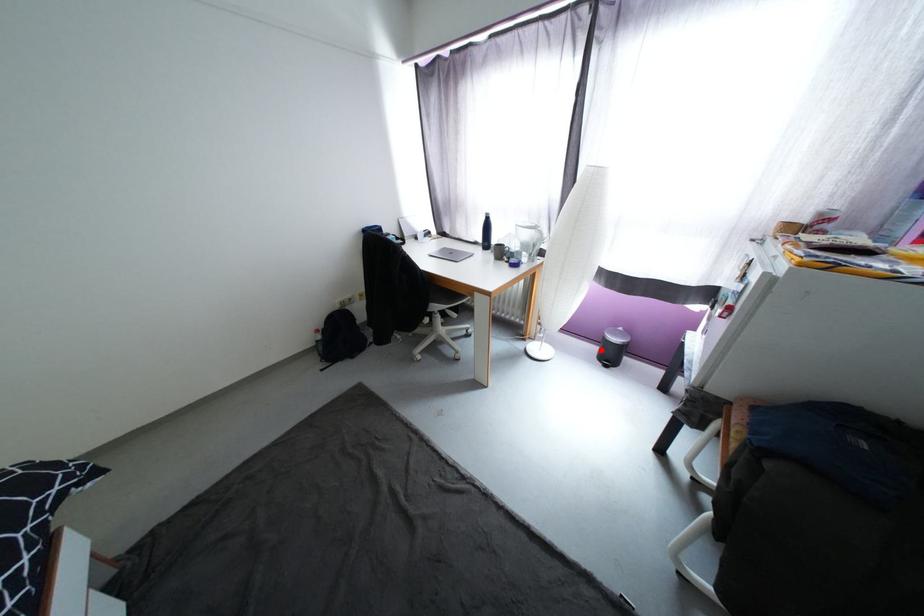
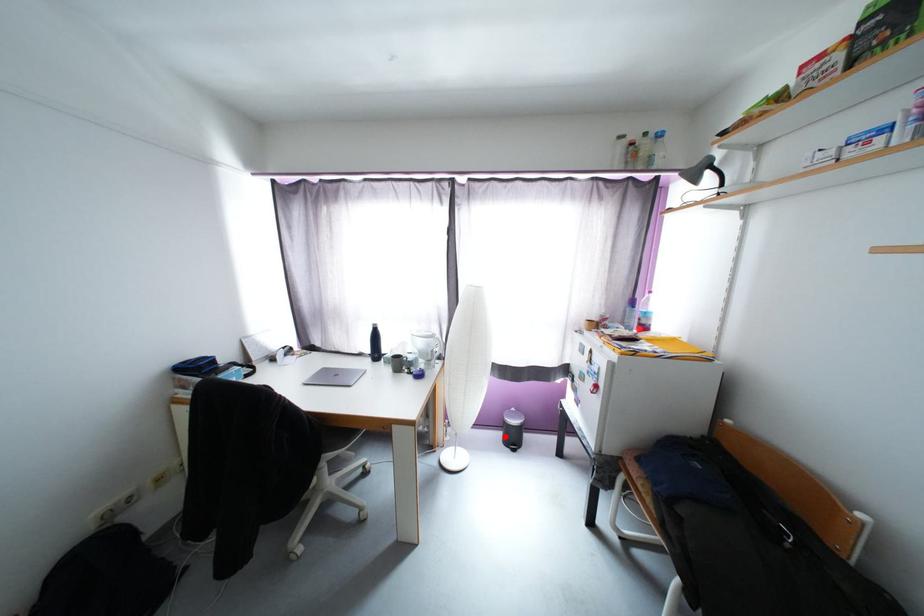
I am providing you with two images of the same scene from different viewpoints. A red point is marked on the first image and another point is marked on the second image. Is the red point in image1 aligned with the point shown in image2?

Yes